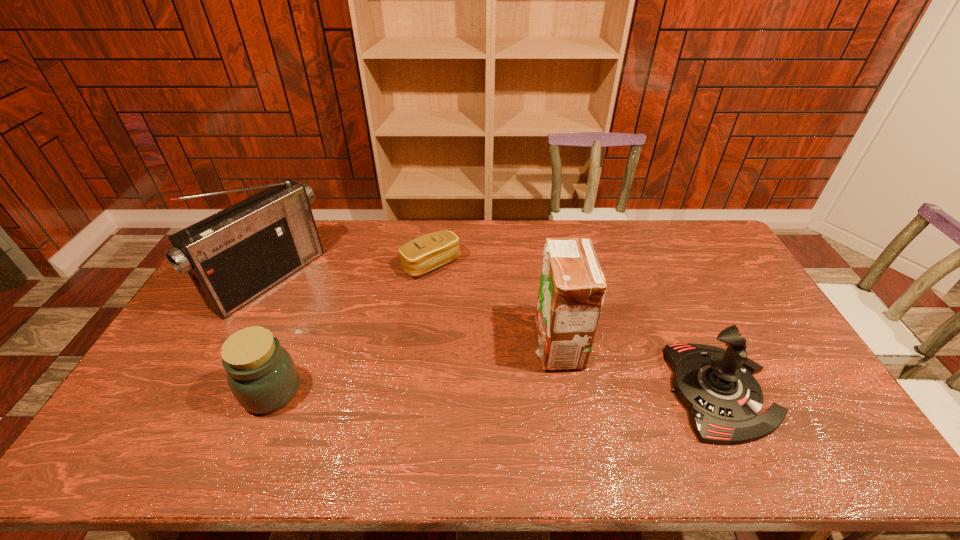
Locate an element on the screen. the second shortest object is located at coordinates (261, 374).

This screenshot has height=540, width=960. I want to click on joystick, so tap(716, 385).

You are a GUI agent. You are given a task and a screenshot of the screen. Output one action in this format:
    pyautogui.click(x=<x>, y=<y>)
    Task: Click on the rightmost object
    
    Given the screenshot: What is the action you would take?
    pyautogui.click(x=716, y=385)

You are a GUI agent. You are given a task and a screenshot of the screen. Output one action in this format:
    pyautogui.click(x=<x>, y=<y>)
    Task: Click on the radio receiver
    This screenshot has height=540, width=960.
    Given the screenshot: What is the action you would take?
    pyautogui.click(x=235, y=255)

The width and height of the screenshot is (960, 540). I want to click on the second tallest object, so click(572, 287).

The height and width of the screenshot is (540, 960). I want to click on the fourth object from left to right, so click(x=572, y=287).

The height and width of the screenshot is (540, 960). What are the coordinates of `the shortest object` in the screenshot? It's located at (430, 251).

Locate an element on the screen. This screenshot has height=540, width=960. the third object from left to right is located at coordinates (430, 251).

Identify the location of vacant space located 0.150m on the right of the second shortest object. (357, 392).

The height and width of the screenshot is (540, 960). Identify the location of free space located 0.050m on the handle side of the joystick. (791, 392).